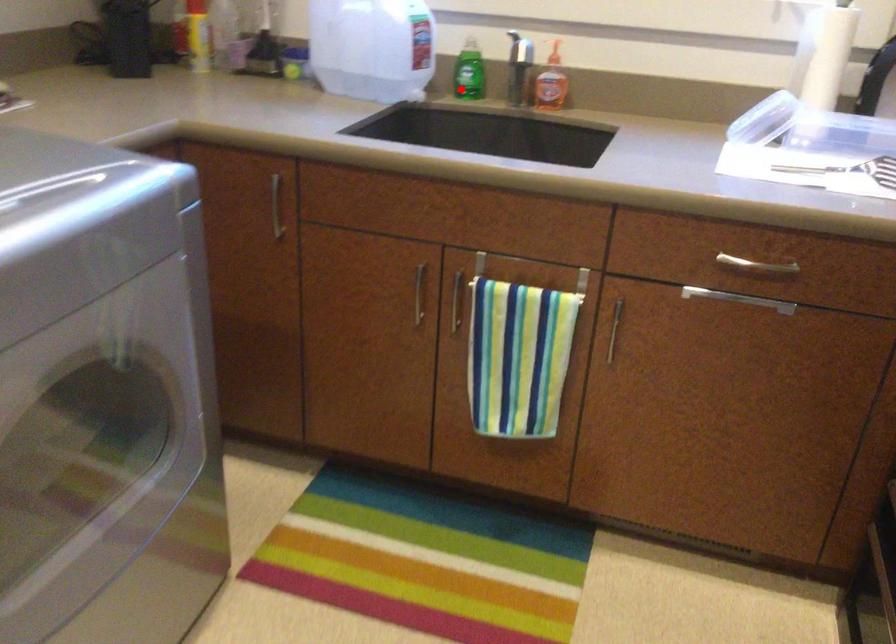
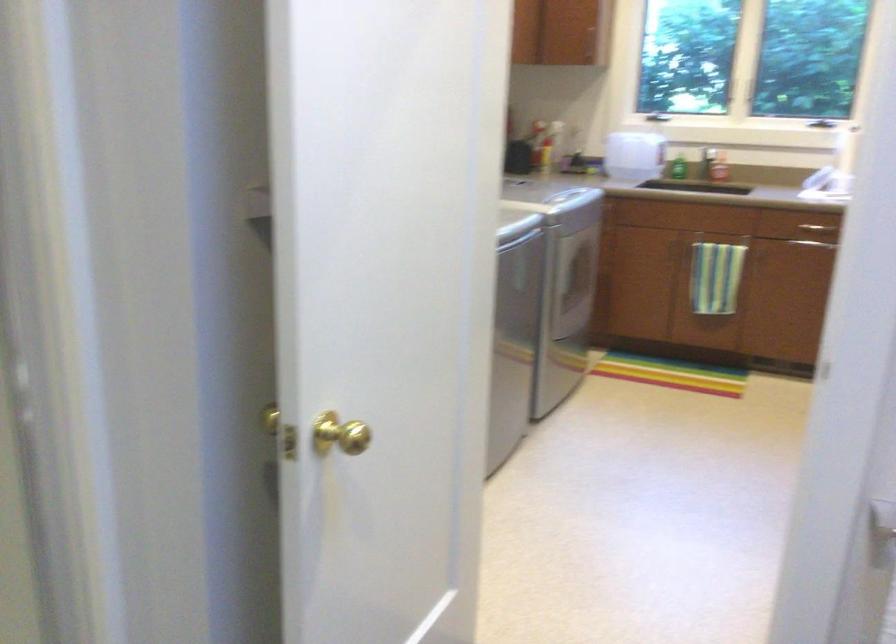
Where in the second image is the point corresponding to the highlighted location from the first image?

(676, 167)